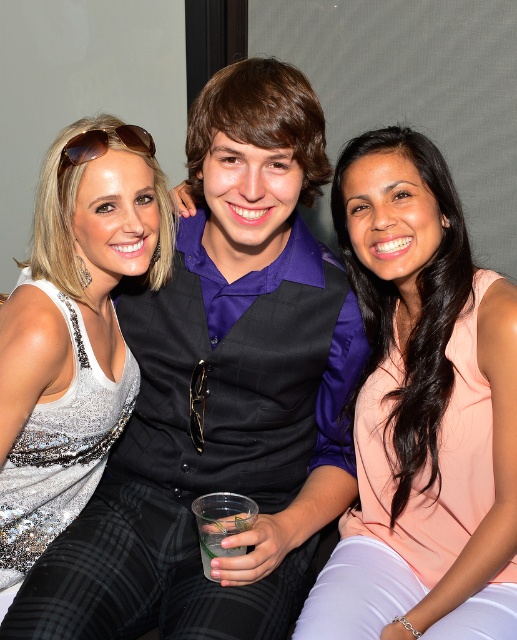
Can you confirm if peach satin blouse at center is positioned to the right of satin silver dress at center?

Correct, you'll find peach satin blouse at center to the right of satin silver dress at center.

Is point (361, 172) more distant than point (25, 424)?

Yes.

Locate an element on the screen. The height and width of the screenshot is (640, 517). peach satin blouse at center is located at coordinates (421, 410).

Does matte black vest at center have a greater width compared to peach satin blouse at center?

Yes.

Does point (55, 632) come behind point (433, 406)?

No, (55, 632) is in front of (433, 406).

Is point (157, 472) positioned behind point (404, 300)?

No.

Where is `matte black vest at center`? matte black vest at center is located at coordinates (220, 394).

Is matte black vest at center thinner than satin silver dress at center?

No, matte black vest at center is not thinner than satin silver dress at center.

Is point (357, 371) positioned after point (42, 474)?

Yes, it is behind point (42, 474).

Locate an element on the screen. matte black vest at center is located at coordinates (220, 394).